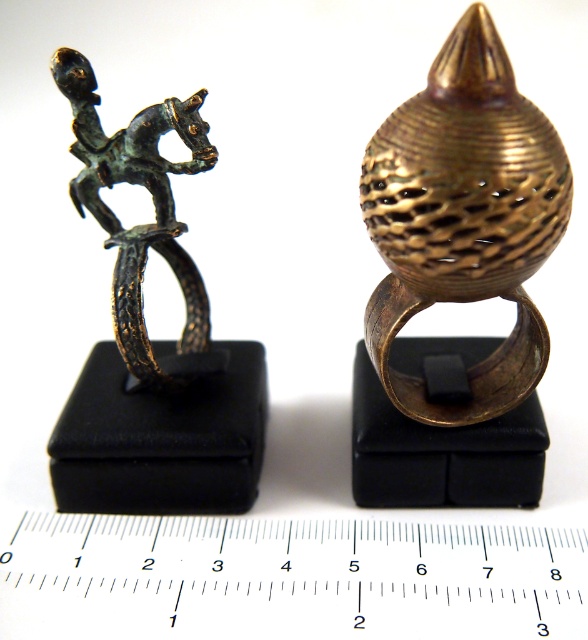
Question: Can you confirm if metallic ruler at center is bigger than bronze figure at left?

Choices:
 (A) yes
 (B) no

Answer: (B)

Question: Which of the following is the farthest from the observer?

Choices:
 (A) (489, 278)
 (B) (516, 528)

Answer: (B)

Question: Is metallic ruler at center above gold textured ring at center?

Choices:
 (A) no
 (B) yes

Answer: (A)

Question: Which point appears farthest from the camera in this image?

Choices:
 (A) (409, 188)
 (B) (507, 620)

Answer: (B)

Question: Which of the following is the closest to the observer?

Choices:
 (A) gold textured ring at center
 (B) bronze figure at left

Answer: (A)

Question: Can you confirm if metallic ruler at center is positioned to the left of bronze figure at left?

Choices:
 (A) no
 (B) yes

Answer: (A)